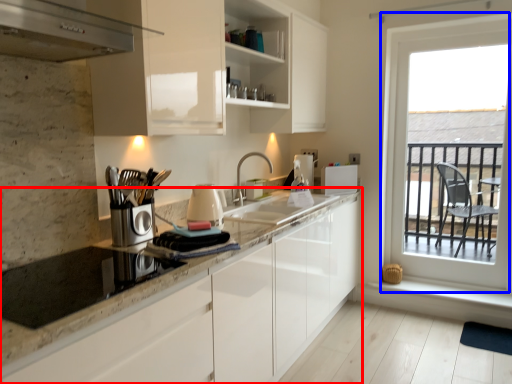
Question: Which of the following is the farthest to the observer, countertop (highlighted by a red box) or window (highlighted by a blue box)?

Choices:
 (A) countertop
 (B) window

Answer: (B)